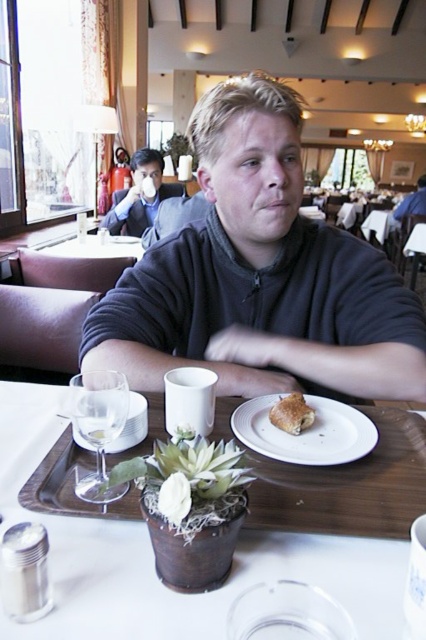
The width and height of the screenshot is (426, 640). What do you see at coordinates (305, 433) in the screenshot?
I see `white matte plate at lower center` at bounding box center [305, 433].

From the picture: Does white matte plate at lower center lie in front of golden flaky pastry at center?

Yes, white matte plate at lower center is in front of golden flaky pastry at center.

Is point (353, 410) more distant than point (313, 410)?

Yes, point (353, 410) is behind point (313, 410).

Find the location of `white matte plate at lower center`. white matte plate at lower center is located at coordinates (305, 433).

Looking at this image, can you confirm if clear glass wine glass at lower left is shorter than matte black sweater at center?

Yes, clear glass wine glass at lower left is shorter than matte black sweater at center.

Is clear glass wine glass at lower left bigger than matte black sweater at center?

Actually, clear glass wine glass at lower left might be smaller than matte black sweater at center.

What do you see at coordinates (98, 426) in the screenshot? I see `clear glass wine glass at lower left` at bounding box center [98, 426].

Find the location of a particular element. Image resolution: width=426 pixels, height=640 pixels. clear glass wine glass at lower left is located at coordinates [98, 426].

Between point (111, 445) and point (279, 416), which one is positioned behind?

Point (279, 416)

Consider the image. Who is positioned more to the right, clear glass at lower left or golden flaky pastry at center?

From the viewer's perspective, golden flaky pastry at center appears more on the right side.

This screenshot has height=640, width=426. I want to click on clear glass at lower left, so [132, 426].